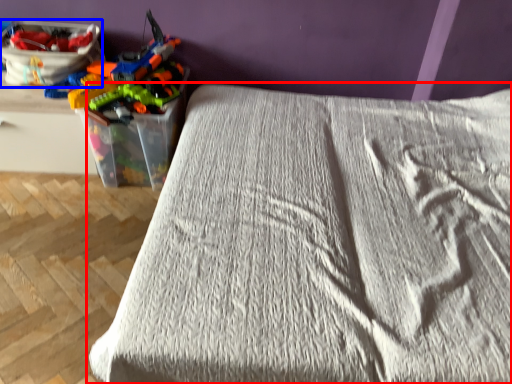
Question: Which point is closer to the camera, bed (highlighted by a red box) or equipment (highlighted by a blue box)?

Choices:
 (A) bed
 (B) equipment

Answer: (A)